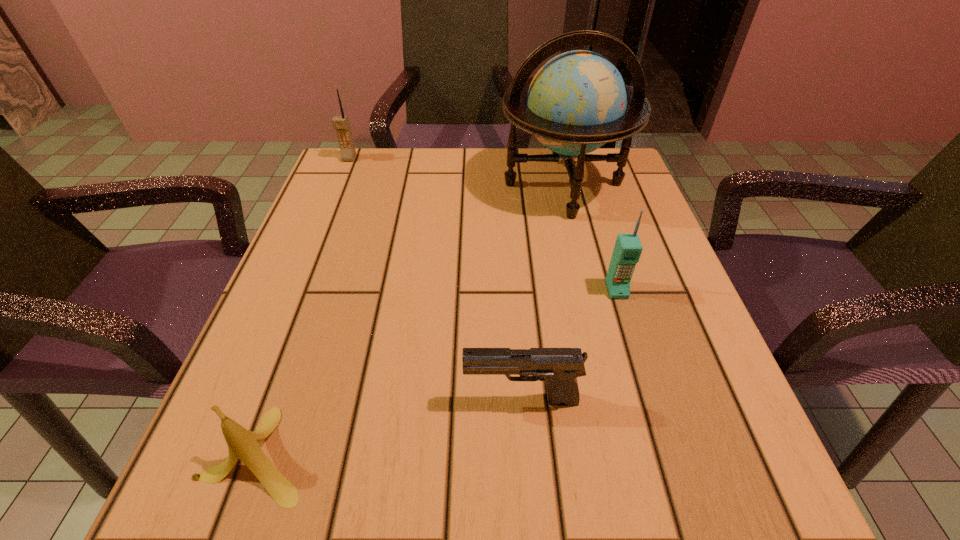
This screenshot has width=960, height=540. In order to click on free location located aim along the barrel of the pistol in this screenshot , I will do pyautogui.click(x=417, y=401).

The image size is (960, 540). Identify the location of vacant area located aim along the barrel of the pistol. (382, 401).

Find the location of a particular element. The height and width of the screenshot is (540, 960). vacant space located 0.060m on the back of the banana is located at coordinates (287, 372).

Where is `globe positioned at the far edge`? The height and width of the screenshot is (540, 960). globe positioned at the far edge is located at coordinates (577, 102).

The image size is (960, 540). Identify the location of cellular telephone present at the far edge. (341, 124).

Where is `object that is positioned at the near edge`? The height and width of the screenshot is (540, 960). object that is positioned at the near edge is located at coordinates (243, 444).

Locate an element on the screen. The image size is (960, 540). cellular telephone that is at the left edge is located at coordinates point(341,124).

Locate an element on the screen. banana located in the left edge section of the desktop is located at coordinates (243, 444).

The width and height of the screenshot is (960, 540). Find the location of `globe at the right edge`. globe at the right edge is located at coordinates (577, 102).

The width and height of the screenshot is (960, 540). In order to click on cellular telephone positioned at the right edge in this screenshot , I will do `click(627, 250)`.